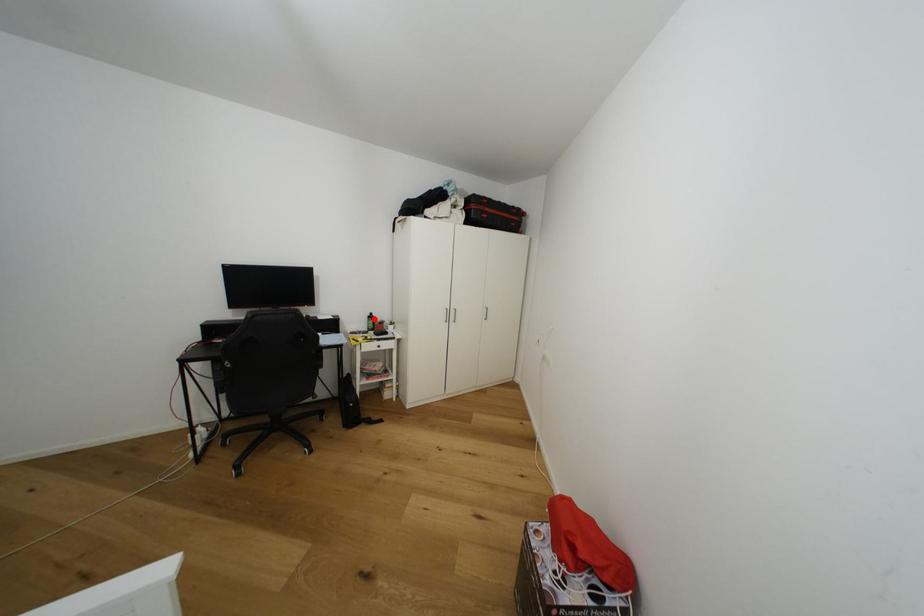
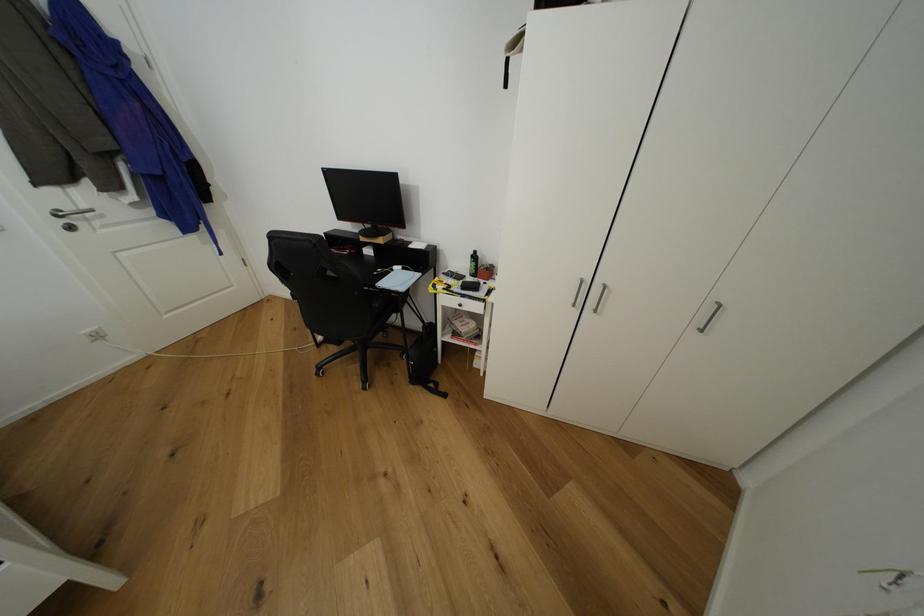
Locate, in the second image, the point that corresponds to the highlighted location in the first image.

(478, 257)